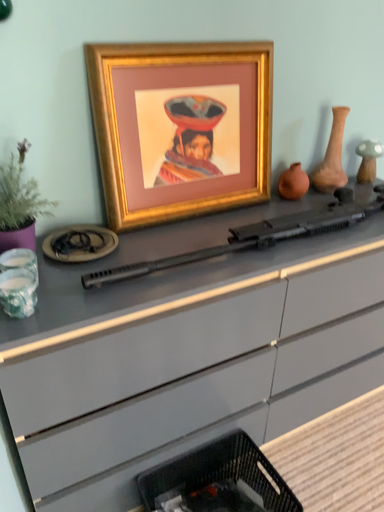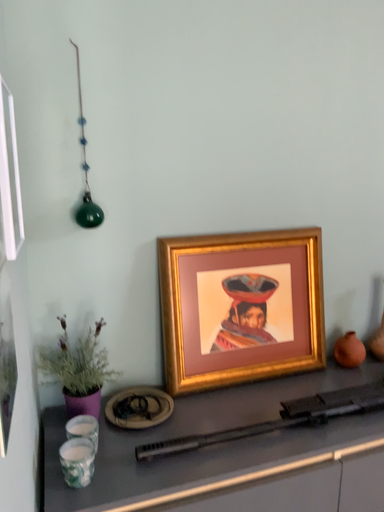
Question: Which way did the camera rotate in the video?

Choices:
 (A) rotated downward
 (B) rotated upward

Answer: (B)